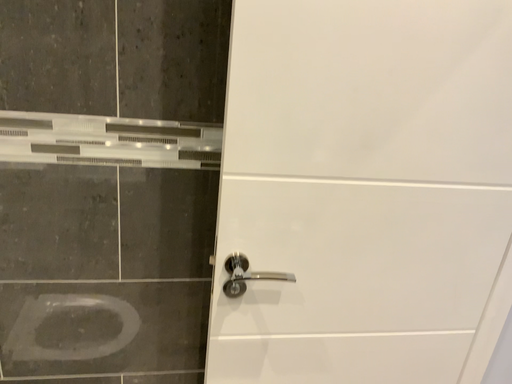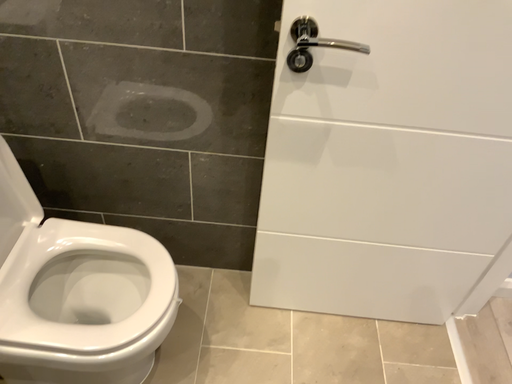
Question: How did the camera likely rotate when shooting the video?

Choices:
 (A) rotated right
 (B) rotated left

Answer: (B)